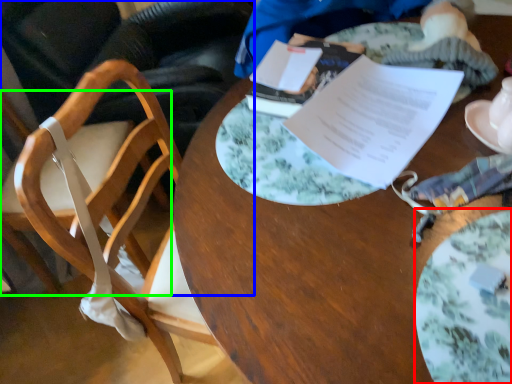
Question: Which is farther away from plate (highlighted by a red box)? chair (highlighted by a blue box) or chair (highlighted by a green box)?

Choices:
 (A) chair
 (B) chair

Answer: (A)